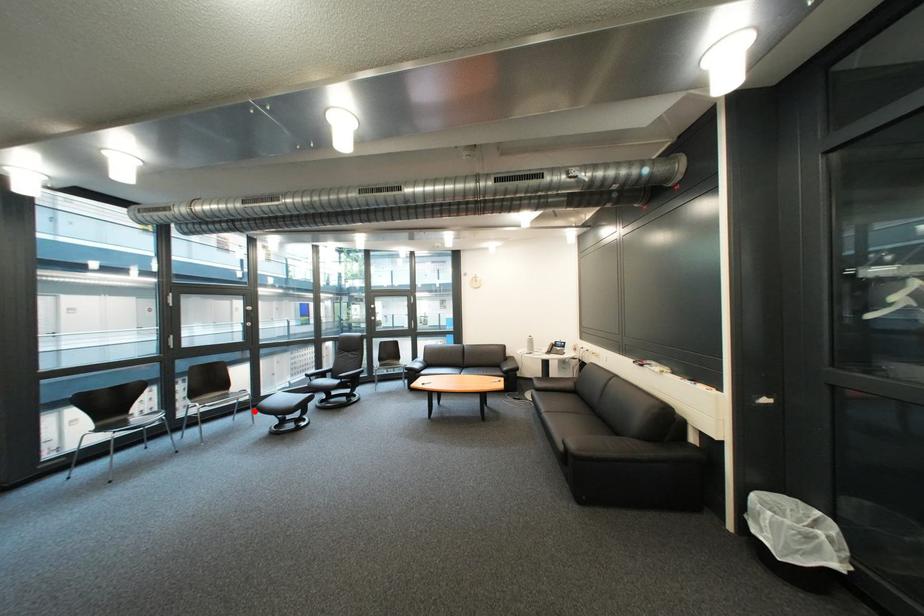
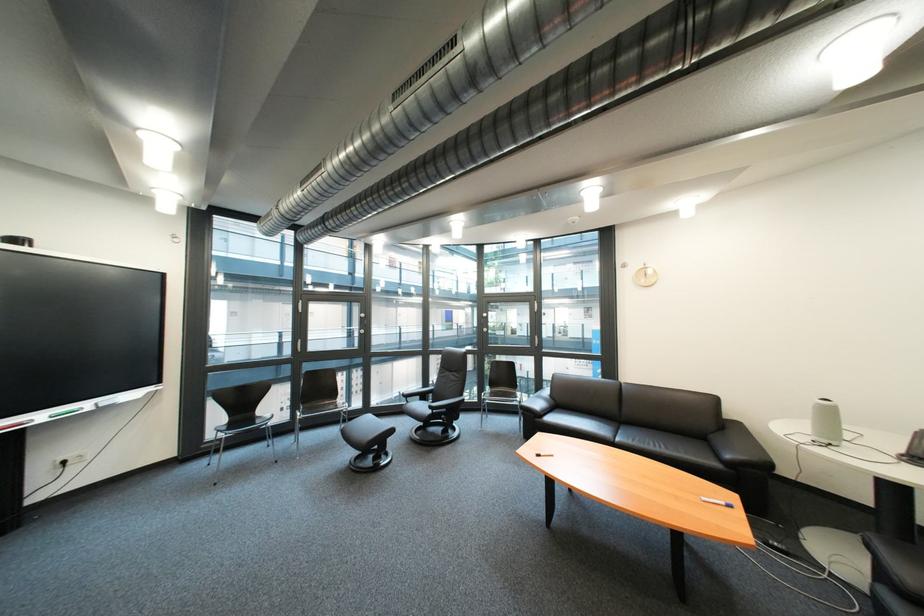
Question: I am providing you with two images of the same scene from different viewpoints. Image1 has a red point marked. In image2, the corresponding 3D location appears at what relative position? Reply with the corresponding letter.

Choices:
 (A) Closer
 (B) Farther

Answer: (A)